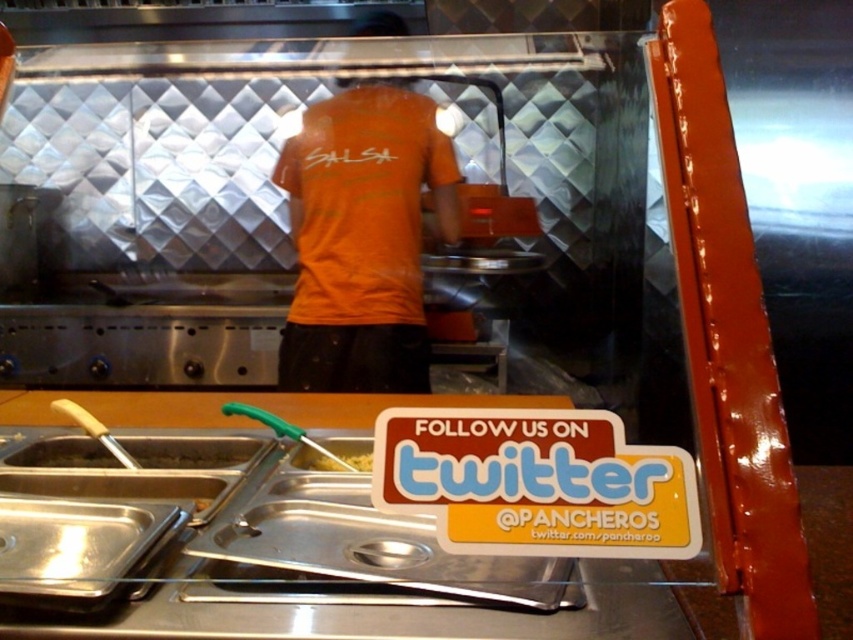
Is orange matte shirt at center wider than yellow matte pasta at center?

Correct, the width of orange matte shirt at center exceeds that of yellow matte pasta at center.

Does point (387, 276) come behind point (328, 467)?

Yes, it is.

The height and width of the screenshot is (640, 853). What are the coordinates of `orange matte shirt at center` in the screenshot? It's located at (363, 237).

Is orange matte shirt at center further to the viewer compared to metallic silver tray at lower left?

That is True.

Can you confirm if orange matte shirt at center is positioned below metallic silver tray at lower left?

Incorrect, orange matte shirt at center is not positioned below metallic silver tray at lower left.

Between point (398, 145) and point (229, 444), which one is positioned behind?

Positioned behind is point (398, 145).

In order to click on orange matte shirt at center in this screenshot , I will do `click(363, 237)`.

Who is higher up, orange matte shirt at center or white plastic sign at lower center?

Positioned higher is orange matte shirt at center.

Is orange matte shirt at center wider than white plastic sign at lower center?

Indeed, orange matte shirt at center has a greater width compared to white plastic sign at lower center.

I want to click on orange matte shirt at center, so click(363, 237).